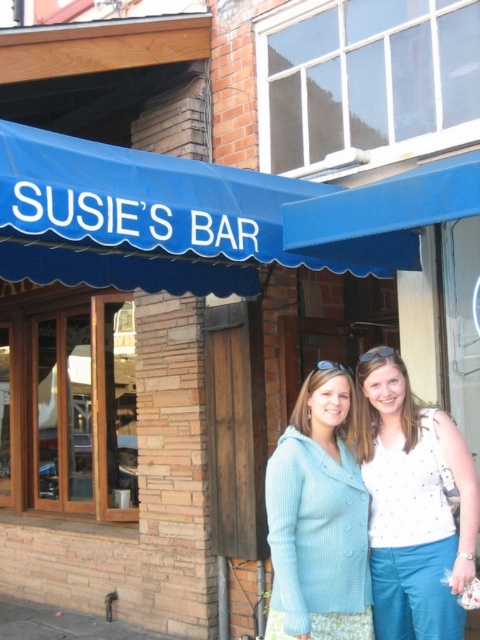
You are a photographer standing 10 feet away from the two people in front of Susie s Bar. You want to take a photo that includes both the white dotted blouse at center and the light blue knit sweater at center. Can you fit both subjects into the frame without zooming in? The camera you are using has a maximum framing capacity of 10 inches.

The distance between the white dotted blouse at center and the light blue knit sweater at center is 8.81 inches. Since the camera can capture up to 10 inches, both subjects can fit within the frame without zooming in.

You are a photographer trying to capture the entire blue fabric awning at upper center and the light blue knit sweater at center in a single frame. Considering their sizes, will the awning cover the sweater in the photo?

The blue fabric awning at upper center is wider than the light blue knit sweater at center, so the awning may cover part of the sweater depending on their positions in the frame.

You are a photographer trying to capture the entire blue fabric awning at upper center and the white dotted blouse at center in one frame. Given that the awning is larger, will you need to adjust your camera angle to include both subjects?

The blue fabric awning at upper center is larger in size than the white dotted blouse at center, so you will need to adjust your camera angle to ensure both are fully visible in the frame.